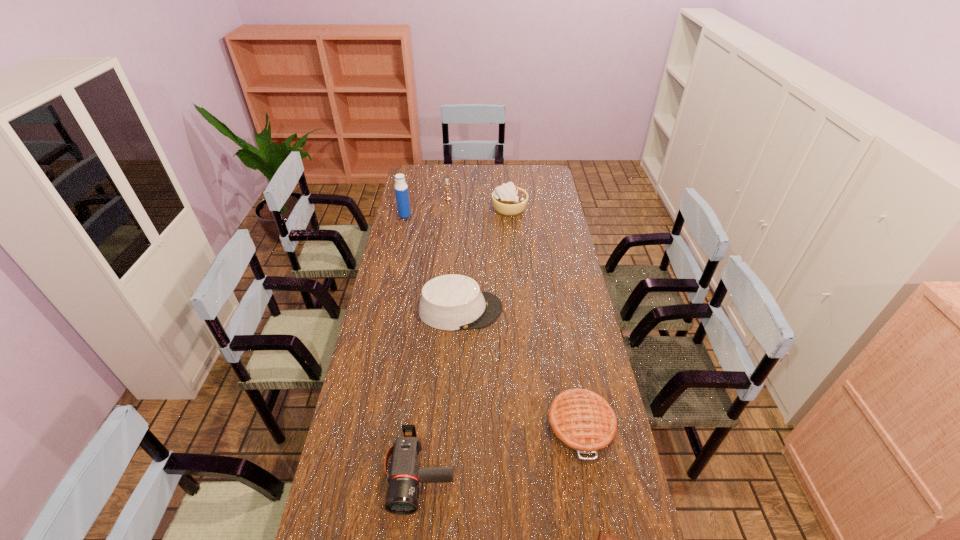
In order to click on water bottle in this screenshot , I will do (x=401, y=189).

Locate an element on the screen. the leftmost object is located at coordinates (401, 189).

This screenshot has height=540, width=960. Identify the location of whipped cream. (507, 199).

I want to click on candle holder, so click(446, 182).

This screenshot has height=540, width=960. What are the coordinates of `hat` in the screenshot? It's located at (451, 302).

You are a GUI agent. You are given a task and a screenshot of the screen. Output one action in this format:
    pyautogui.click(x=<x>, y=<y>)
    Task: Click on the camcorder
    This screenshot has width=960, height=540.
    Given the screenshot: What is the action you would take?
    click(x=402, y=498)

Image resolution: width=960 pixels, height=540 pixels. Identify the location of pie. (582, 421).

Where is `vacant space positioned on the back of the water bottle`? Image resolution: width=960 pixels, height=540 pixels. vacant space positioned on the back of the water bottle is located at coordinates (414, 175).

Find the location of `vacant area located on the left of the whipped cream`. vacant area located on the left of the whipped cream is located at coordinates (x=469, y=208).

The height and width of the screenshot is (540, 960). I want to click on blank area located on the front of the candle holder, so click(x=444, y=237).